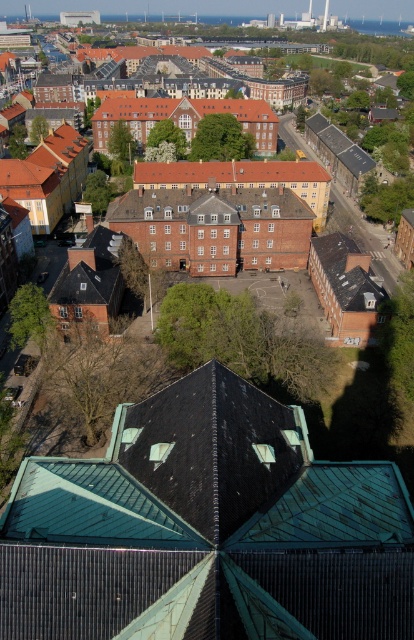
From the picture: Can you confirm if green copper roof at center is smaller than red tile roof at center?

No, green copper roof at center is not smaller than red tile roof at center.

Does point (161, 536) come closer to viewer compared to point (189, 170)?

Yes, it is in front of point (189, 170).

Is point (353, 618) closer to viewer compared to point (259, 173)?

That is True.

Identify the location of green copper roof at center. (207, 529).

What do you see at coordinates (202, 200) in the screenshot?
I see `brown matte building at center` at bounding box center [202, 200].

Locate an element on the screen. Image resolution: width=414 pixels, height=640 pixels. brown matte building at center is located at coordinates (202, 200).

Is green copper roof at center closer to the viewer compared to brown brick building at center?

Yes, it is in front of brown brick building at center.

Find the location of a particular element. green copper roof at center is located at coordinates (207, 529).

What do you see at coordinates (207, 529) in the screenshot?
I see `green copper roof at center` at bounding box center [207, 529].

Identify the location of green copper roof at center. pos(207,529).